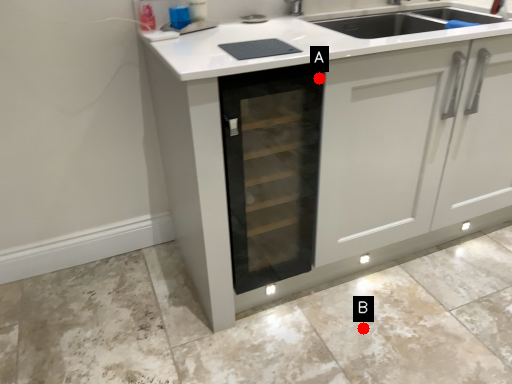
Question: Two points are circled on the image, labeled by A and B beside each circle. Which point is farther to the camera?

Choices:
 (A) A is further
 (B) B is further

Answer: (B)